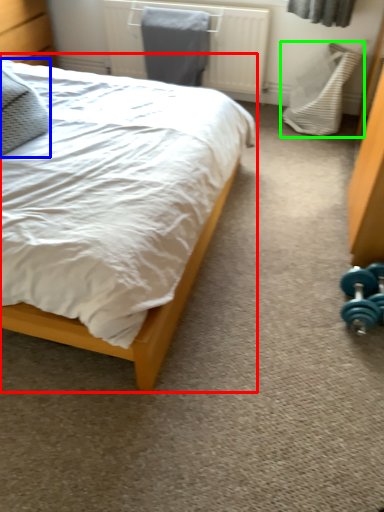
Question: Which is nearer to the bed (highlighted by a red box)? pillow (highlighted by a blue box) or swivel chair (highlighted by a green box).

Choices:
 (A) pillow
 (B) swivel chair

Answer: (A)